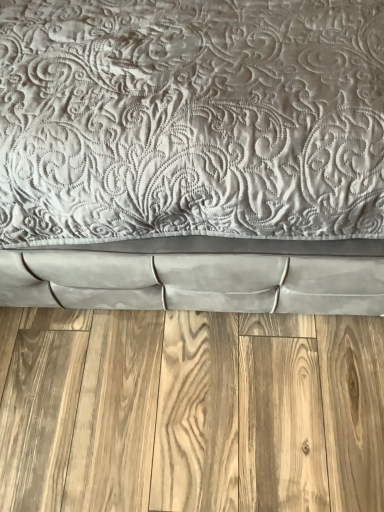
Question: From a real-world perspective, is satin gray quilted bed at center physically located above or below natural wood flooring at bottom?

Choices:
 (A) below
 (B) above

Answer: (B)

Question: Is satin gray quilted bed at center inside the boundaries of natural wood flooring at bottom, or outside?

Choices:
 (A) outside
 (B) inside

Answer: (A)

Question: From the image's perspective, is satin gray quilted bed at center above or below natural wood flooring at bottom?

Choices:
 (A) above
 (B) below

Answer: (A)

Question: Based on their positions, is natural wood flooring at bottom located to the left or right of satin gray quilted bed at center?

Choices:
 (A) left
 (B) right

Answer: (A)

Question: From a real-world perspective, is natural wood flooring at bottom above or below satin gray quilted bed at center?

Choices:
 (A) above
 (B) below

Answer: (B)

Question: Is natural wood flooring at bottom inside or outside of satin gray quilted bed at center?

Choices:
 (A) outside
 (B) inside

Answer: (A)

Question: Considering the positions of natural wood flooring at bottom and satin gray quilted bed at center in the image, is natural wood flooring at bottom taller or shorter than satin gray quilted bed at center?

Choices:
 (A) short
 (B) tall

Answer: (A)